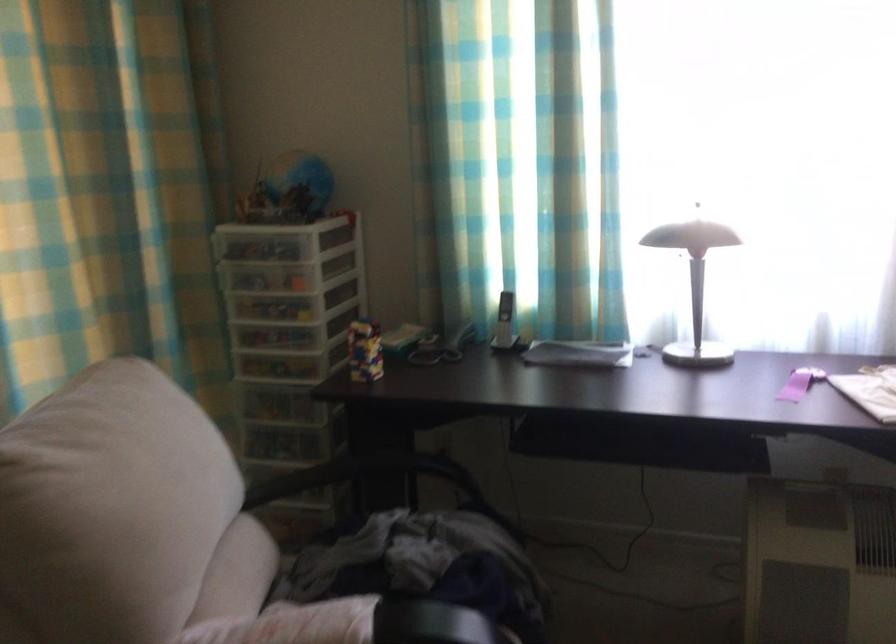
The image size is (896, 644). Find the location of `black chair armrest`. black chair armrest is located at coordinates (429, 623).